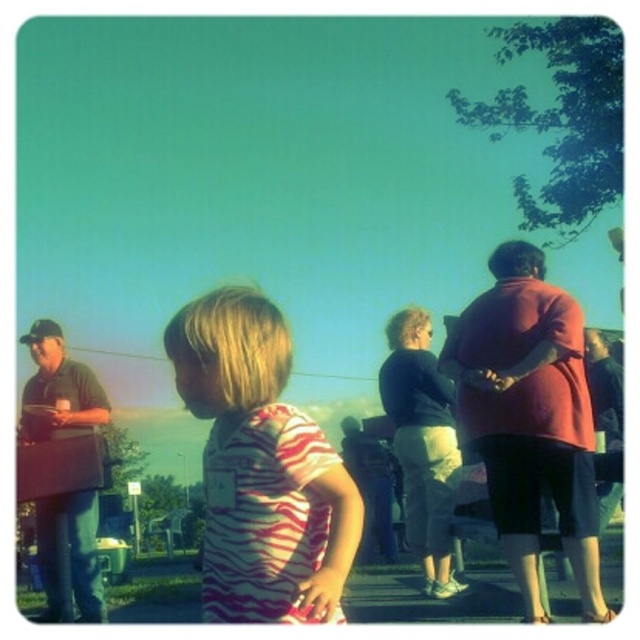
Question: Is zebra-striped shirt at center in front of matte red jacket at right?

Choices:
 (A) yes
 (B) no

Answer: (A)

Question: Which object appears closest to the camera in this image?

Choices:
 (A) matte red jacket at right
 (B) zebra-striped shirt at center

Answer: (B)

Question: Does zebra-striped shirt at center have a larger size compared to matte red jacket at right?

Choices:
 (A) no
 (B) yes

Answer: (A)

Question: Is zebra-striped shirt at center above matte red jacket at right?

Choices:
 (A) no
 (B) yes

Answer: (B)